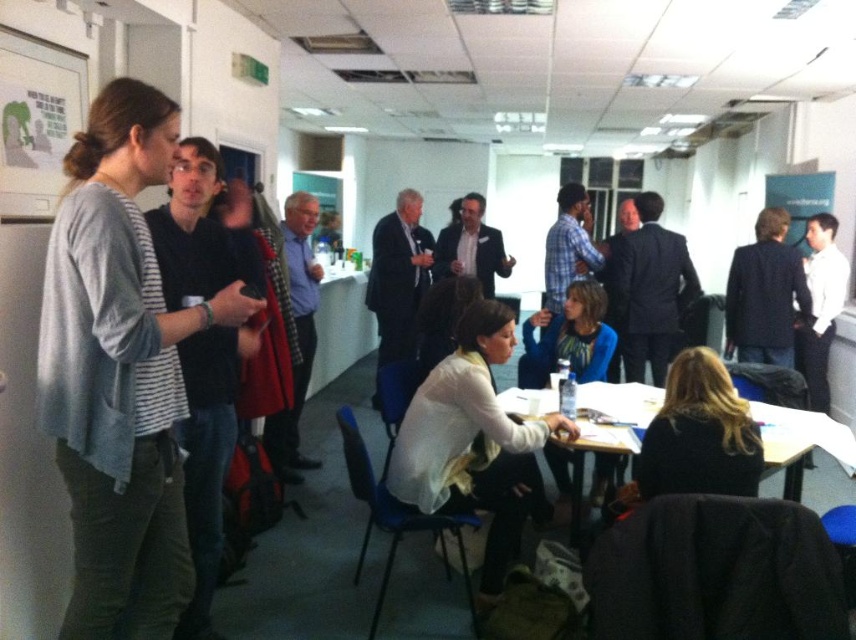
Question: Does white soft sweater at center have a larger size compared to blue fabric jacket at center?

Choices:
 (A) no
 (B) yes

Answer: (B)

Question: Where is white paper at upper left located in relation to blue fabric jacket at center in the image?

Choices:
 (A) right
 (B) left

Answer: (B)

Question: Does white soft sweater at center appear over blue fabric jacket at center?

Choices:
 (A) no
 (B) yes

Answer: (A)

Question: Among these points, which one is nearest to the camera?

Choices:
 (A) (589, 365)
 (B) (706, 448)

Answer: (B)

Question: Among these objects, which one is nearest to the camera?

Choices:
 (A) white soft sweater at center
 (B) light gray sweater at left
 (C) blue fabric jacket at center
 (D) wooden table at lower right

Answer: (B)

Question: Which of the following is the closest to the observer?

Choices:
 (A) white soft sweater at center
 (B) dark brown hair at lower right
 (C) wooden table at lower right
 (D) light gray sweater at left

Answer: (D)